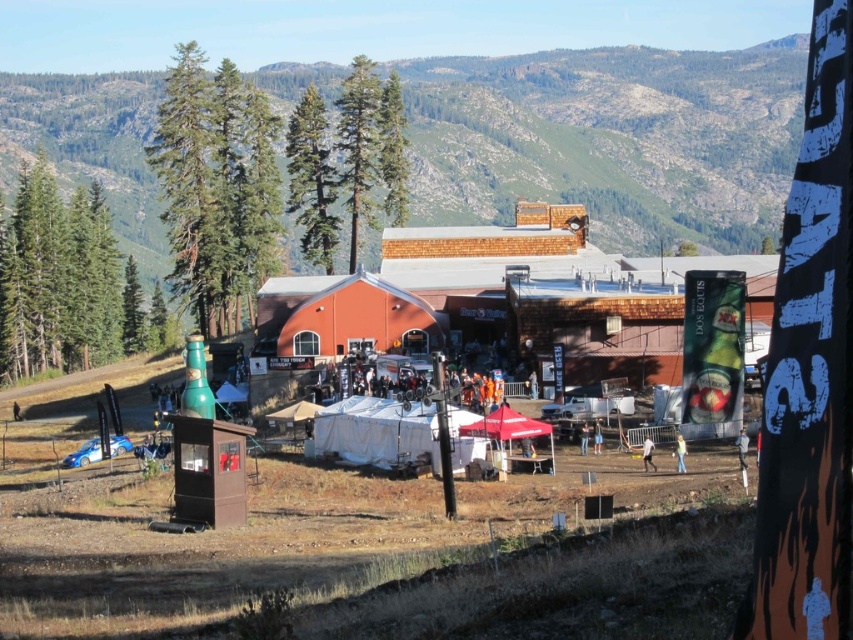
You are planning to set up a new food stall between the green textured tree at left and the green coniferous tree at upper center. The stall requires a minimum of 70 feet of space between the two trees to accommodate equipment and a walkway. Is the available distance sufficient?

The distance between the green textured tree at left and the green coniferous tree at upper center is 85.00 feet, which exceeds the required 70 feet. Therefore, the available space is sufficient for setting up the food stall with the necessary equipment and walkway.